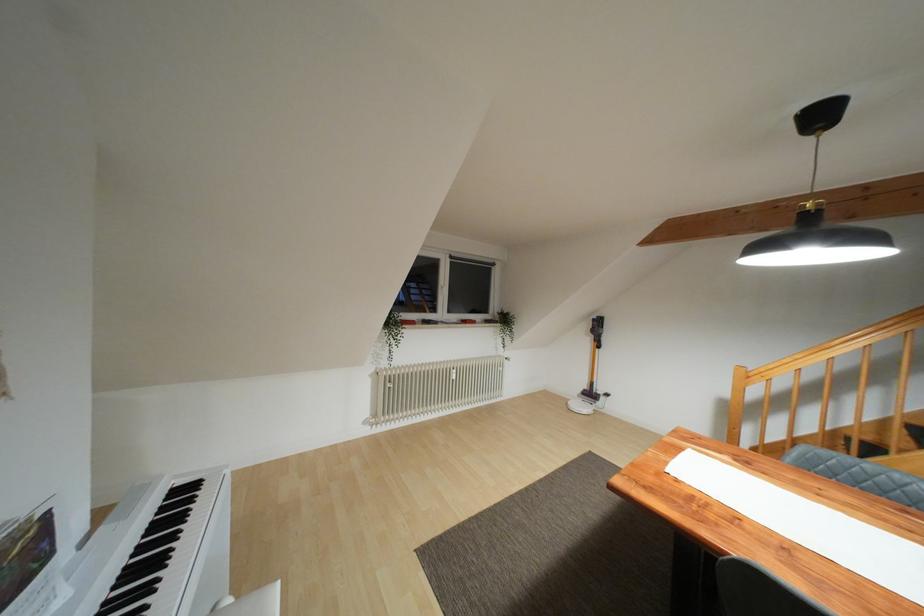
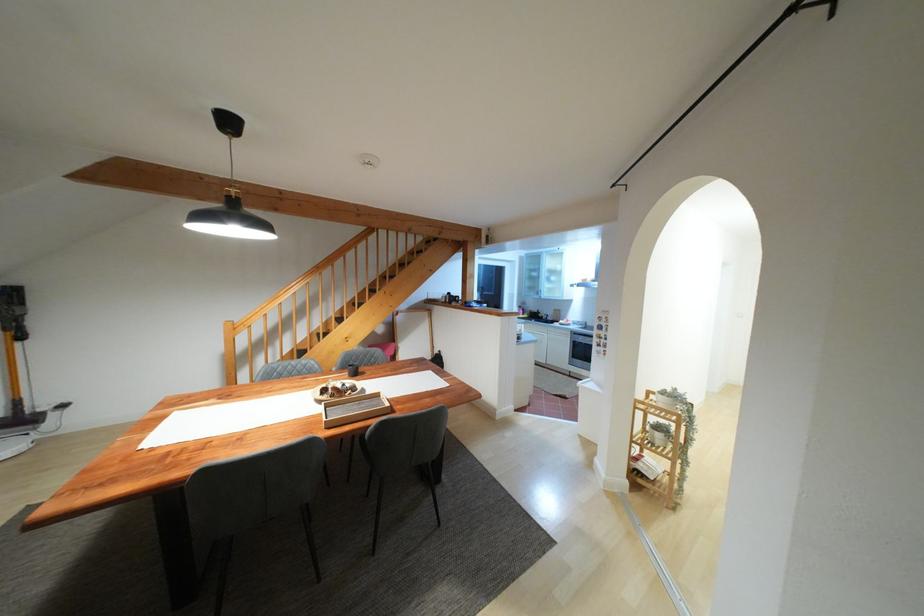
Question: How did the camera likely rotate?

Choices:
 (A) Left
 (B) Right
 (C) Up
 (D) Down

Answer: (B)